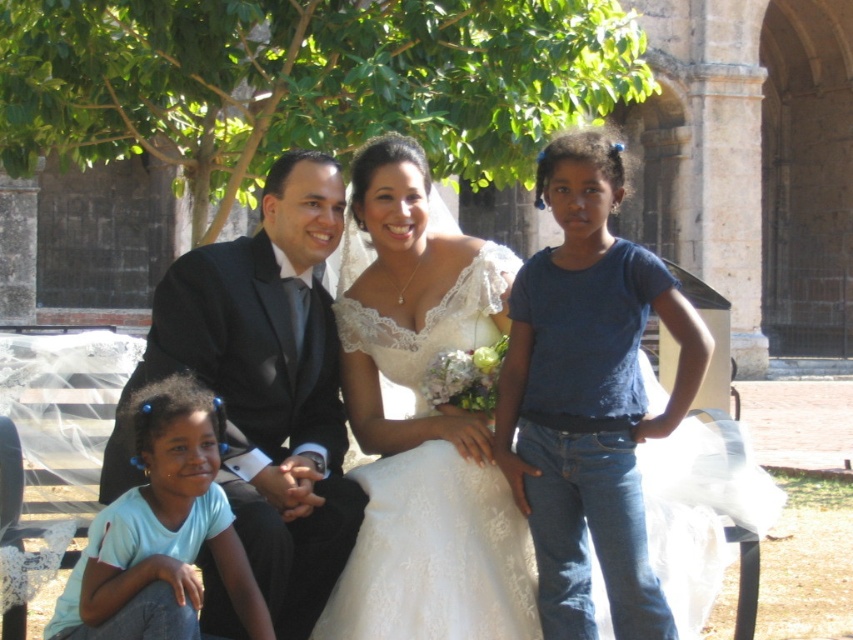
You are a photographer at a wedding and want to position a decorative arch between the blue denim jeans at center and the shiny black suit at center. Since the arch needs to be placed closer to the taller object, where should you place it?

The blue denim jeans at center is taller than the shiny black suit at center, so the arch should be placed closer to the blue denim jeans at center.

You are a photographer at a wedding. The couple is seated on a bench. The bride is wearing a white lace wedding gown, and the groom is wearing a suit. You need to position yourself so that you can capture both the matte black suit at center and the shiny black suit at center in the same frame. Given that your camera has a 6.5 feet field of view, will you be able to fit both suits into the frame?

The matte black suit at center and shiny black suit at center are 7.00 feet apart. Since the distance between them exceeds the camera field of view of 6.5 feet, you will not be able to fit both suits into the frame.

You are a photographer trying to capture the best angle for a group photo. You notice two points marked in the scene. Which point is closer to you, point (560, 637) or point (184, 330)?

Point (560, 637) is closer to the viewer than point (184, 330).